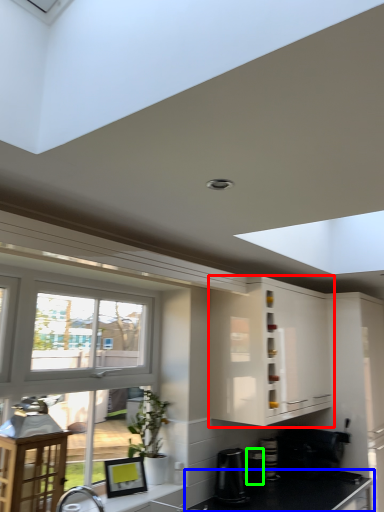
Question: Which object is positioned closest to cabinetry (highlighted by a red box)? Select from countertop (highlighted by a blue box) and appliance (highlighted by a green box).

Choices:
 (A) countertop
 (B) appliance

Answer: (A)